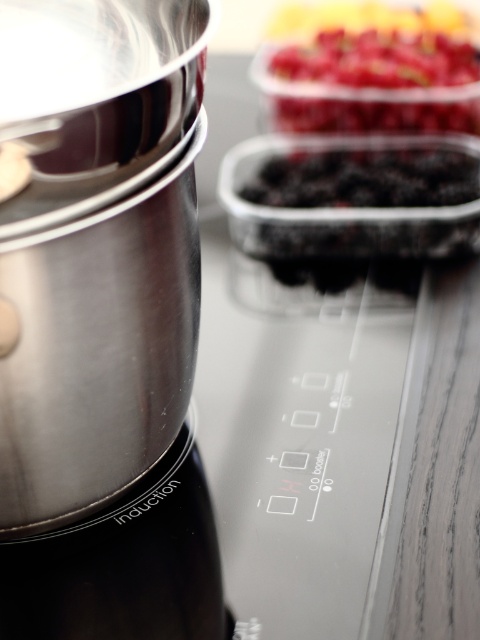
Question: Can you confirm if polished metal mixer at left is positioned to the left of glossy plastic berries at upper center?

Choices:
 (A) no
 (B) yes

Answer: (B)

Question: Which object appears closest to the camera in this image?

Choices:
 (A) polished metal mixer at left
 (B) glossy plastic berries at upper center

Answer: (A)

Question: Can you confirm if polished metal mixer at left is wider than glossy plastic berries at upper center?

Choices:
 (A) yes
 (B) no

Answer: (B)

Question: Does polished metal mixer at left have a lesser width compared to glossy plastic berries at upper center?

Choices:
 (A) no
 (B) yes

Answer: (B)